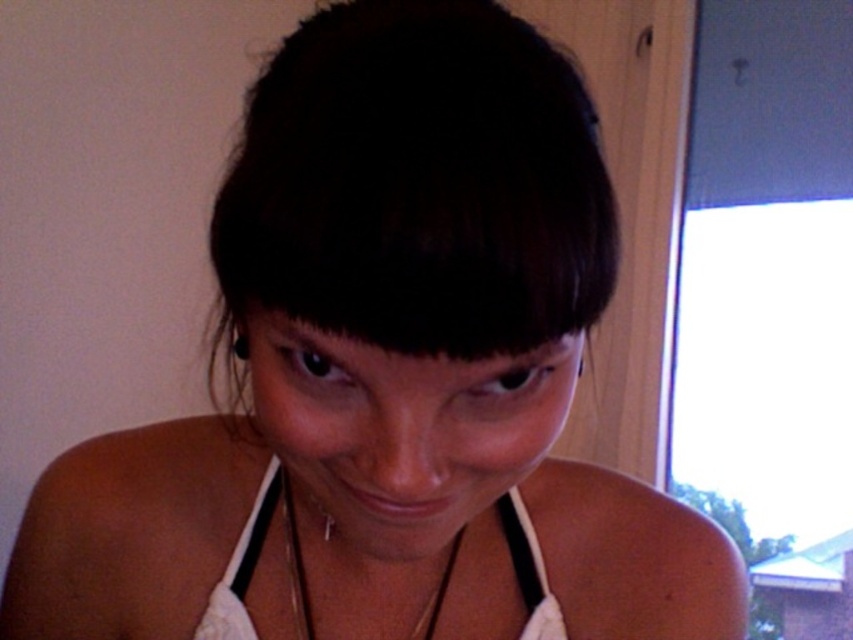
You are a photographer adjusting the camera focus. The subject has dark brown hair at center and a gold chain at lower center. Which object should you focus on first if you want to capture both in sharp detail?

The dark brown hair at center should be focused on first because it is larger in size compared to the gold chain at lower center, making it more prominent and requiring attention to detail.

You are a fashion designer observing the image and want to ensure the white fabric bikini top at center and the white fabric strap at lower center are proportionate. Based on their positions, which one is taller?

The white fabric bikini top at center is much taller than the white fabric strap at lower center.

You are a fashion designer examining a model wearing the white fabric bikini top at center and the white fabric strap at lower center. Which item is bigger in size?

The white fabric bikini top at center is larger in size compared to the white fabric strap at lower center according to the description.